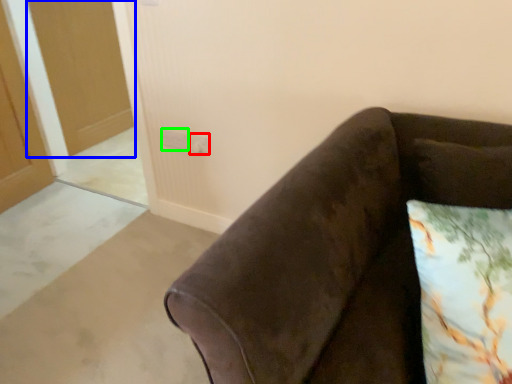
Question: Estimate the real-world distances between objects in this image. Which object is closer to electric outlet (highlighted by a red box), glass door (highlighted by a blue box) or electric outlet (highlighted by a green box)?

Choices:
 (A) glass door
 (B) electric outlet

Answer: (B)